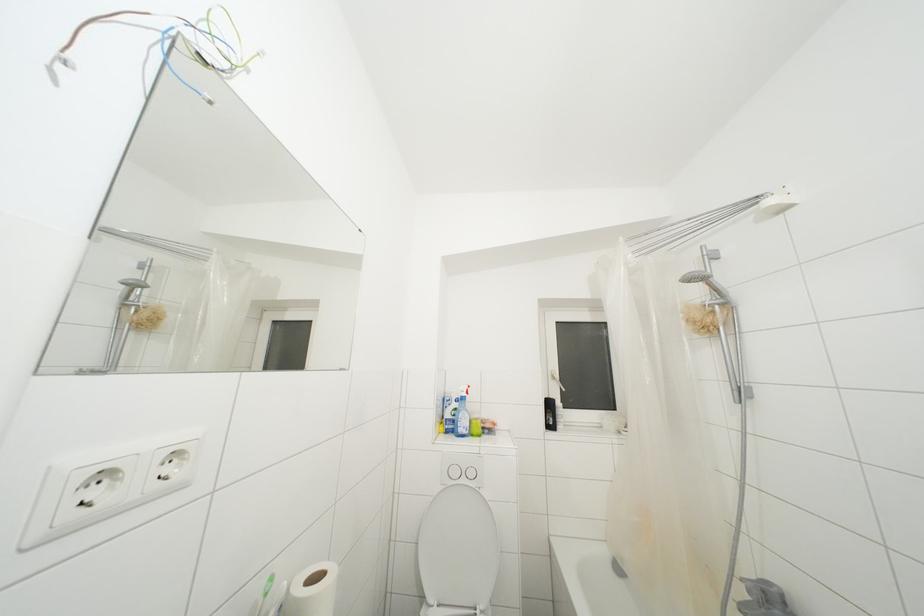
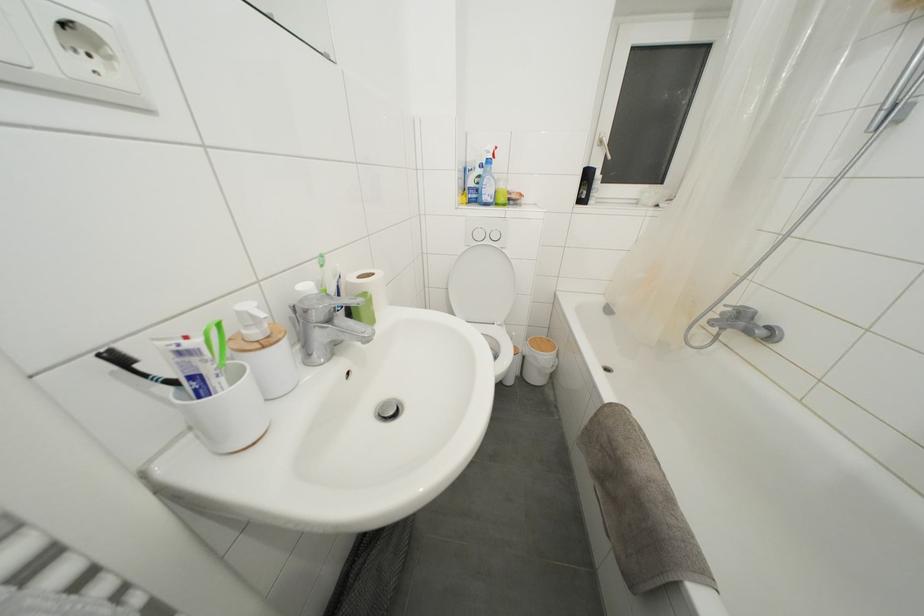
In the second image, find the point that corresponds to [553,410] in the first image.

(591, 180)